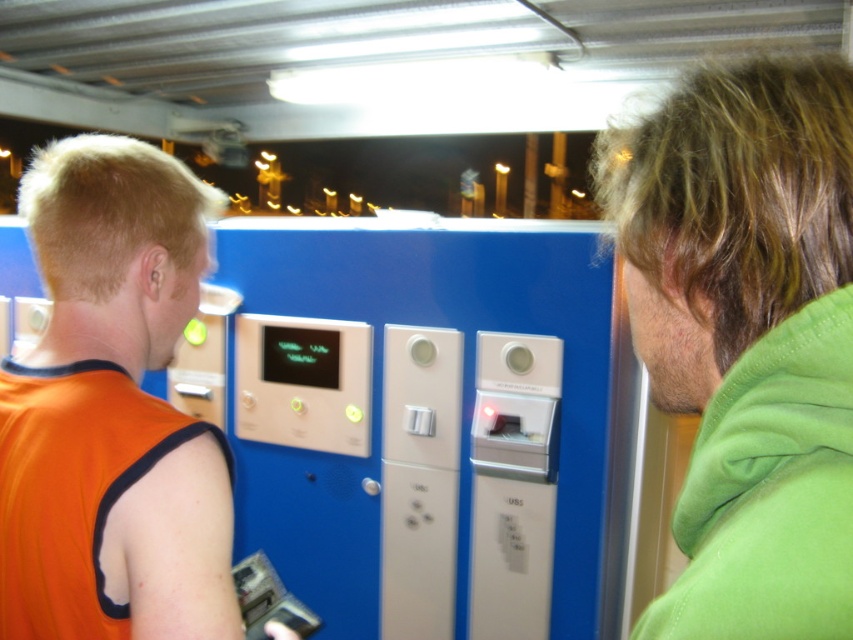
Is green fleece jacket at right bigger than orange fabric sleeveless shirt at left?

No.

Can you confirm if green fleece jacket at right is positioned above orange fabric sleeveless shirt at left?

Correct, green fleece jacket at right is located above orange fabric sleeveless shirt at left.

Is point (830, 225) less distant than point (167, 435)?

Yes, point (830, 225) is closer to viewer.

You are a GUI agent. You are given a task and a screenshot of the screen. Output one action in this format:
    pyautogui.click(x=<x>, y=<y>)
    Task: Click on the green fleece jacket at right
    Image resolution: width=853 pixels, height=640 pixels.
    Given the screenshot: What is the action you would take?
    pyautogui.click(x=746, y=330)